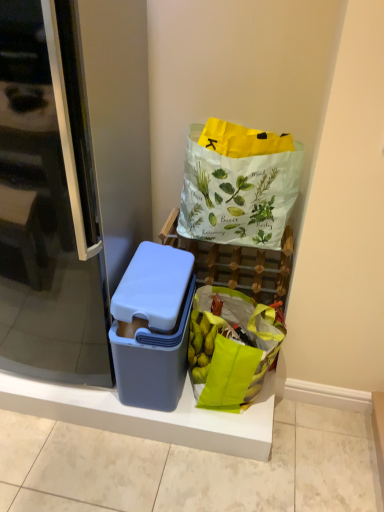
Question: From the image's perspective, is matte plastic lunch box at center located beneath white paper bag with green leaf illustrations at upper right?

Choices:
 (A) yes
 (B) no

Answer: (A)

Question: Does matte plastic lunch box at center appear on the right side of white paper bag with green leaf illustrations at upper right?

Choices:
 (A) yes
 (B) no

Answer: (B)

Question: Is matte plastic lunch box at center bigger than white paper bag with green leaf illustrations at upper right?

Choices:
 (A) no
 (B) yes

Answer: (A)

Question: Is matte plastic lunch box at center surrounding white paper bag with green leaf illustrations at upper right?

Choices:
 (A) no
 (B) yes

Answer: (A)

Question: Is matte plastic lunch box at center at the left side of white paper bag with green leaf illustrations at upper right?

Choices:
 (A) yes
 (B) no

Answer: (A)

Question: Is matte plastic lunch box at center thinner than white paper bag with green leaf illustrations at upper right?

Choices:
 (A) yes
 (B) no

Answer: (B)

Question: Is matte plastic container at left bigger than transparent plastic container at left?

Choices:
 (A) no
 (B) yes

Answer: (A)

Question: Can you confirm if matte plastic container at left is smaller than transparent plastic container at left?

Choices:
 (A) yes
 (B) no

Answer: (A)

Question: Does matte plastic container at left lie in front of transparent plastic container at left?

Choices:
 (A) yes
 (B) no

Answer: (B)

Question: Is transparent plastic container at left at the back of matte plastic container at left?

Choices:
 (A) yes
 (B) no

Answer: (B)

Question: Is matte plastic container at left wider than transparent plastic container at left?

Choices:
 (A) yes
 (B) no

Answer: (B)

Question: From a real-world perspective, does matte plastic container at left stand above transparent plastic container at left?

Choices:
 (A) no
 (B) yes

Answer: (A)

Question: From the image's perspective, does white paper bag with green leaf illustrations at upper right appear lower than green fabric grocery bag at lower right?

Choices:
 (A) no
 (B) yes

Answer: (A)